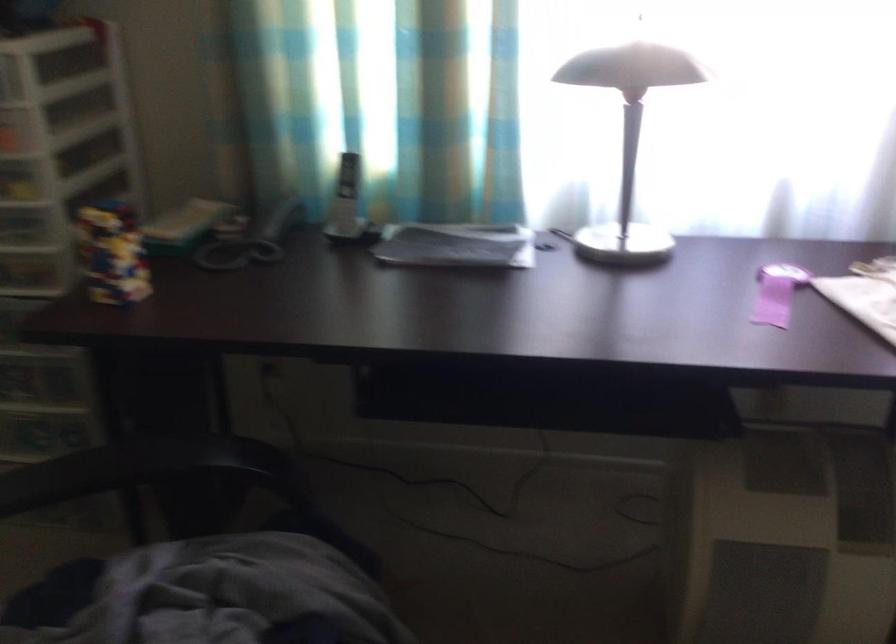
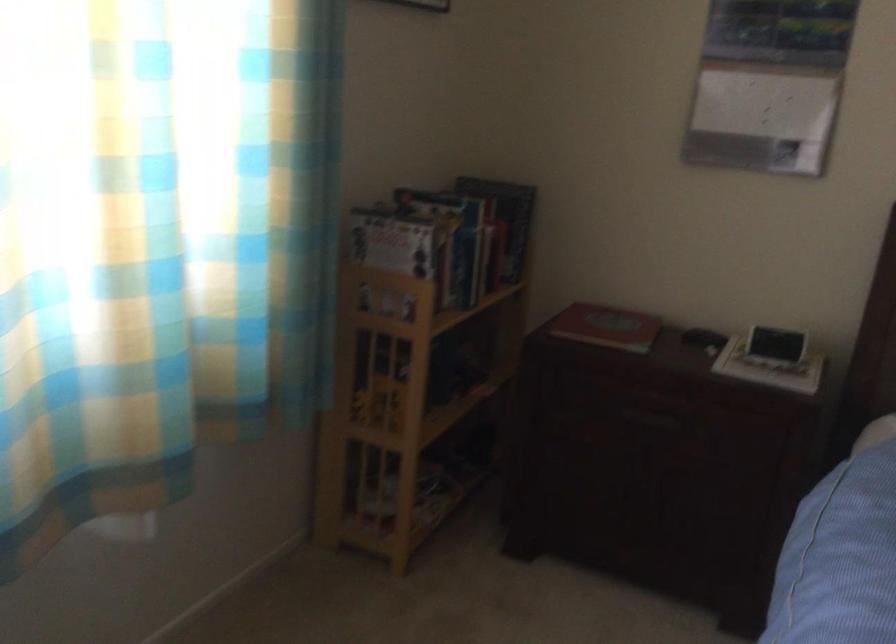
Question: The first image is from the beginning of the video and the second image is from the end. How did the camera likely rotate when shooting the video?

Choices:
 (A) Left
 (B) Right
 (C) Up
 (D) Down

Answer: (B)